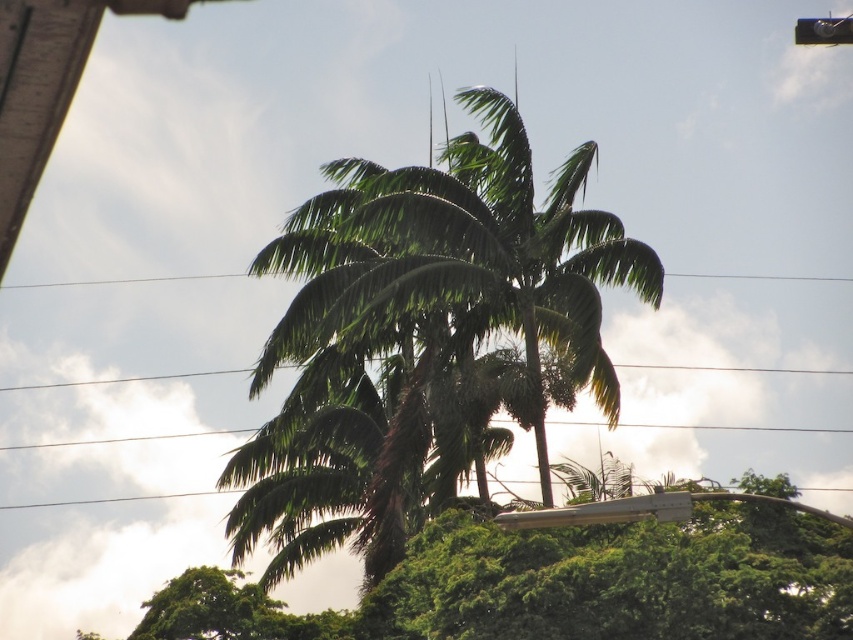
Question: Can you confirm if green leafy coconut tree at center is positioned below green leafy palm at center?

Choices:
 (A) yes
 (B) no

Answer: (B)

Question: Which object is closer to the camera taking this photo?

Choices:
 (A) green leafy coconut tree at center
 (B) green leafy palm at center

Answer: (B)

Question: Can you confirm if green leafy coconut tree at center is smaller than green leafy palm at center?

Choices:
 (A) yes
 (B) no

Answer: (A)

Question: Is green leafy coconut tree at center bigger than green leafy palm at center?

Choices:
 (A) yes
 (B) no

Answer: (B)

Question: Which object appears closest to the camera in this image?

Choices:
 (A) green leafy coconut tree at center
 (B) green leafy palm at center

Answer: (B)